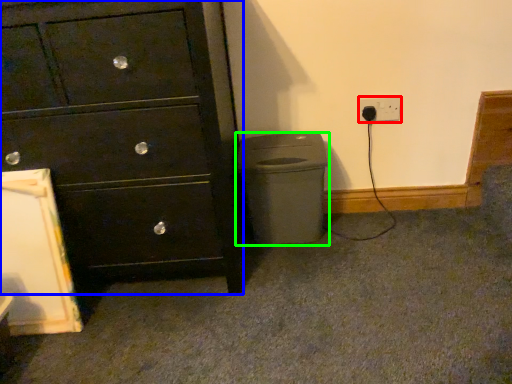
Question: Which is nearer to the power plugs and sockets (highlighted by a red box)? chest of drawers (highlighted by a blue box) or waste container (highlighted by a green box).

Choices:
 (A) chest of drawers
 (B) waste container

Answer: (B)